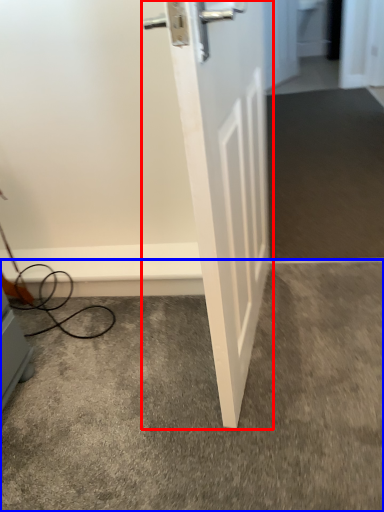
Question: Which point is further to the camera, door (highlighted by a red box) or concrete (highlighted by a blue box)?

Choices:
 (A) door
 (B) concrete

Answer: (B)